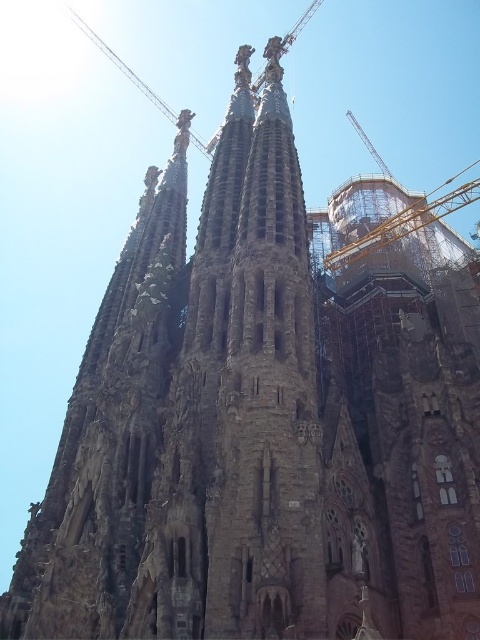
Question: Does metallic scaffolding at right come behind metallic construction crane at upper center?

Choices:
 (A) no
 (B) yes

Answer: (A)

Question: Is metallic scaffolding at right to the left of metallic construction crane at upper center from the viewer's perspective?

Choices:
 (A) yes
 (B) no

Answer: (B)

Question: Which of the following is the closest to the observer?

Choices:
 (A) (255, 86)
 (B) (460, 192)

Answer: (A)

Question: Does metallic scaffolding at right have a larger size compared to metallic construction crane at upper center?

Choices:
 (A) no
 (B) yes

Answer: (B)

Question: Which object is farther from the camera taking this photo?

Choices:
 (A) metallic scaffolding at right
 (B) metallic construction crane at upper center

Answer: (B)